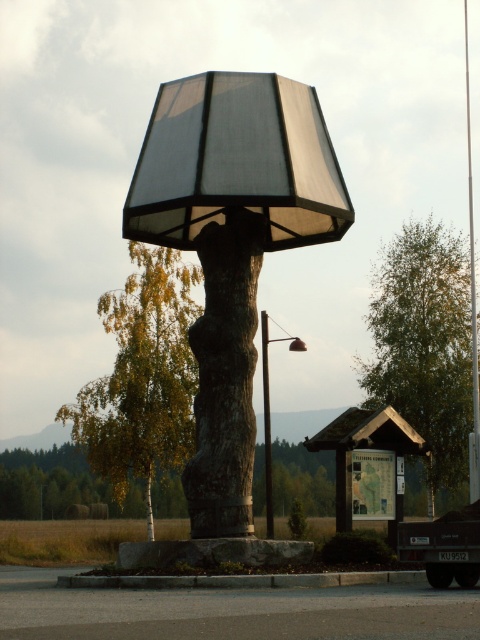
Question: In this image, where is green leafy tree at center located relative to green leafy tree at right?

Choices:
 (A) right
 (B) left

Answer: (B)

Question: Which point is closer to the camera?

Choices:
 (A) green leafy tree at right
 (B) green leafy tree at center

Answer: (A)

Question: Considering the relative positions of green leafy tree at center and rough bark tree trunk at center in the image provided, where is green leafy tree at center located with respect to rough bark tree trunk at center?

Choices:
 (A) above
 (B) below

Answer: (A)

Question: Considering the real-world distances, which object is closest to the green leafy tree at center?

Choices:
 (A) matte glass table lamp at center
 (B) rough bark tree trunk at center
 (C) matte black lampshade at center

Answer: (A)

Question: Which is nearer to the matte glass table lamp at center?

Choices:
 (A) matte black lampshade at center
 (B) rough bark tree trunk at center
 (C) matte black pole at center

Answer: (C)

Question: Is green leafy tree at right positioned at the back of matte black pole at center?

Choices:
 (A) yes
 (B) no

Answer: (A)